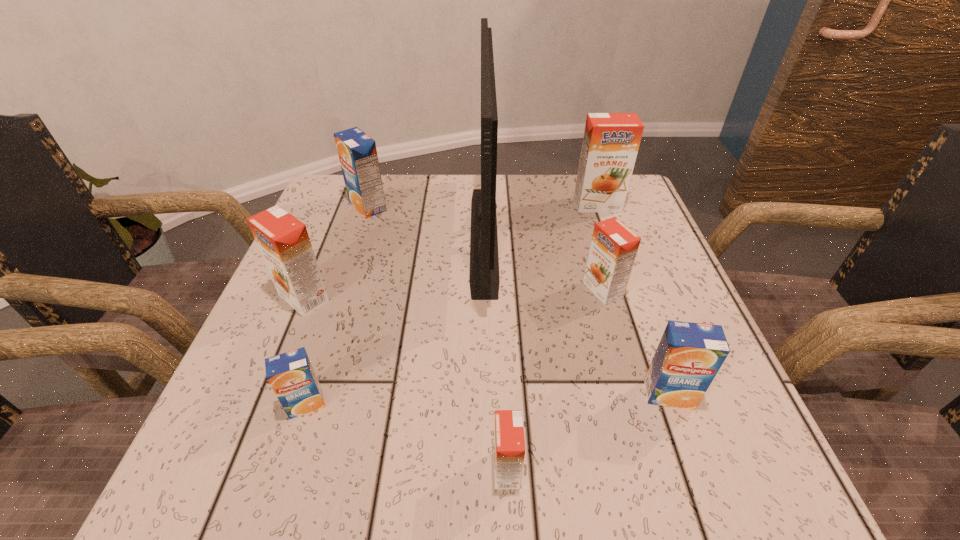
You are a GUI agent. You are given a task and a screenshot of the screen. Output one action in this format:
    pyautogui.click(x=<x>, y=<y>)
    Task: Click on the monitor
    The height and width of the screenshot is (540, 960).
    Given the screenshot: What is the action you would take?
    pyautogui.click(x=484, y=279)

Find the location of `the seventh shortest object`. the seventh shortest object is located at coordinates (611, 141).

Where is `the tallest orange juice`? The width and height of the screenshot is (960, 540). the tallest orange juice is located at coordinates (611, 141).

The image size is (960, 540). Find the location of `the biggest blue orange_juice`. the biggest blue orange_juice is located at coordinates pos(357,152).

Locate an element on the screen. The height and width of the screenshot is (540, 960). the second biggest orange orange juice is located at coordinates (x=283, y=241).

At what (x,y) coordinates should I click in order to perform the action: click on the third biggest orange orange juice. Please return your answer as a coordinate pair (x, y). Image resolution: width=960 pixels, height=540 pixels. Looking at the image, I should click on (613, 249).

Locate an element on the screen. the second biggest blue orange_juice is located at coordinates (689, 355).

Find the location of a particular element. Image resolution: width=960 pixels, height=540 pixels. the smallest blue orange_juice is located at coordinates (291, 375).

This screenshot has width=960, height=540. What are the coordinates of `the second orange orange juice from left to right` in the screenshot? It's located at (509, 445).

You are a GUI agent. You are given a task and a screenshot of the screen. Output one action in this format:
    pyautogui.click(x=<x>, y=<y>)
    Task: Click on the fourth orange juice from left to right
    
    Given the screenshot: What is the action you would take?
    pyautogui.click(x=509, y=445)